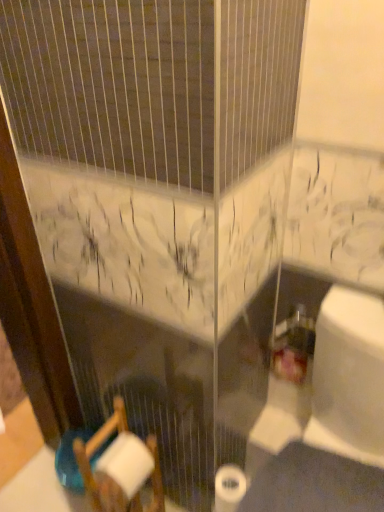
Find the location of `white matte toilet paper at lower center`. white matte toilet paper at lower center is located at coordinates (229, 488).

Image resolution: width=384 pixels, height=512 pixels. What do you see at coordinates (229, 488) in the screenshot? I see `white matte toilet paper at lower center` at bounding box center [229, 488].

In order to click on white matte toilet paper at lower center in this screenshot , I will do `click(229, 488)`.